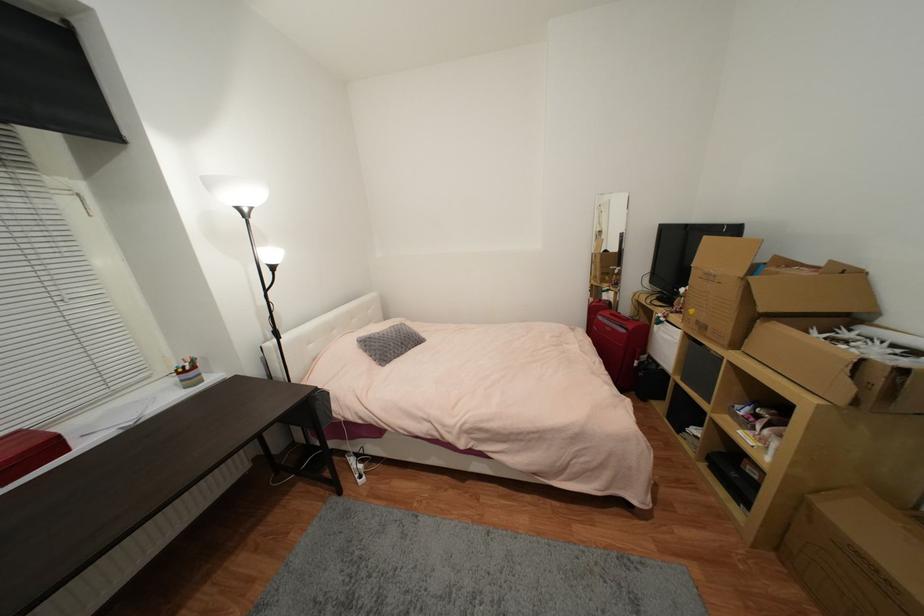
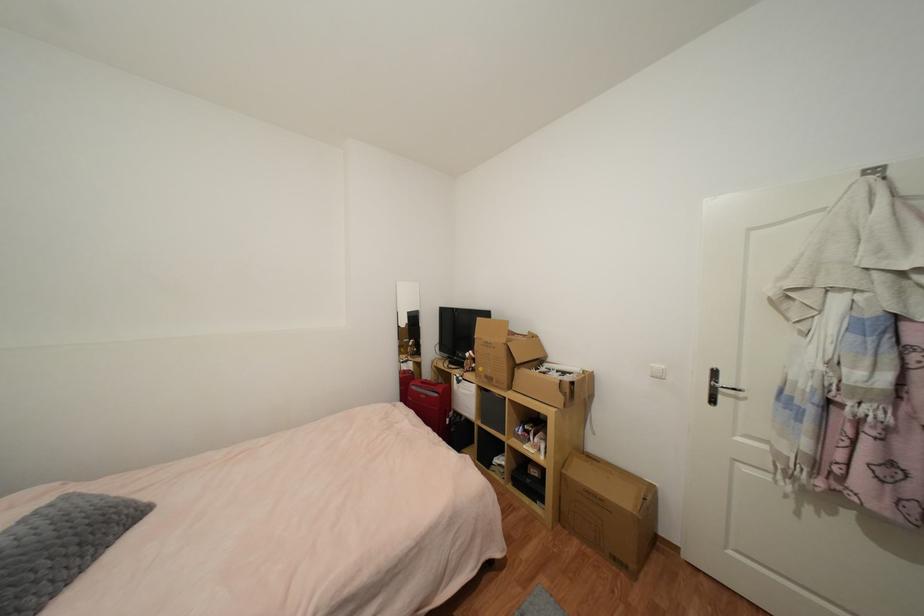
Locate, in the second image, the point that corresponds to (x=666, y=321) in the first image.

(465, 379)